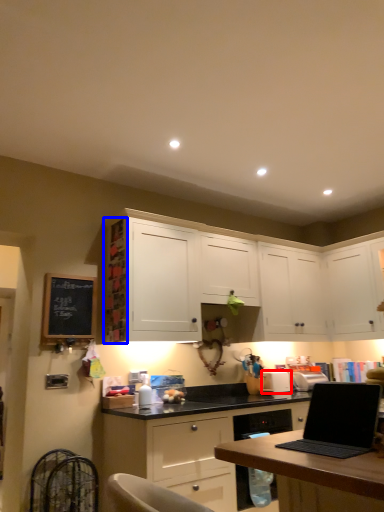
Question: Which of the following is the farthest to the observer, appliance (highlighted by a red box) or shelf (highlighted by a blue box)?

Choices:
 (A) appliance
 (B) shelf

Answer: (A)